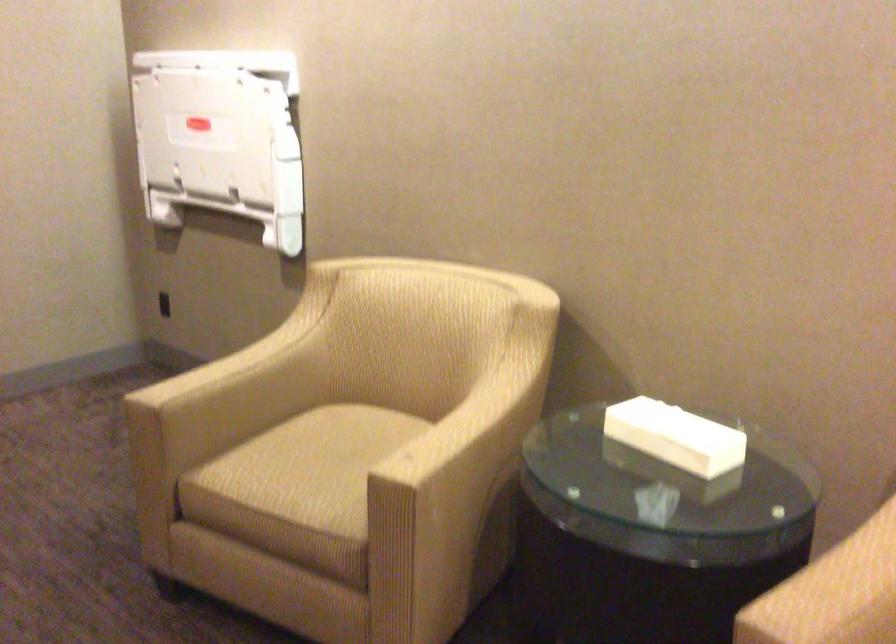
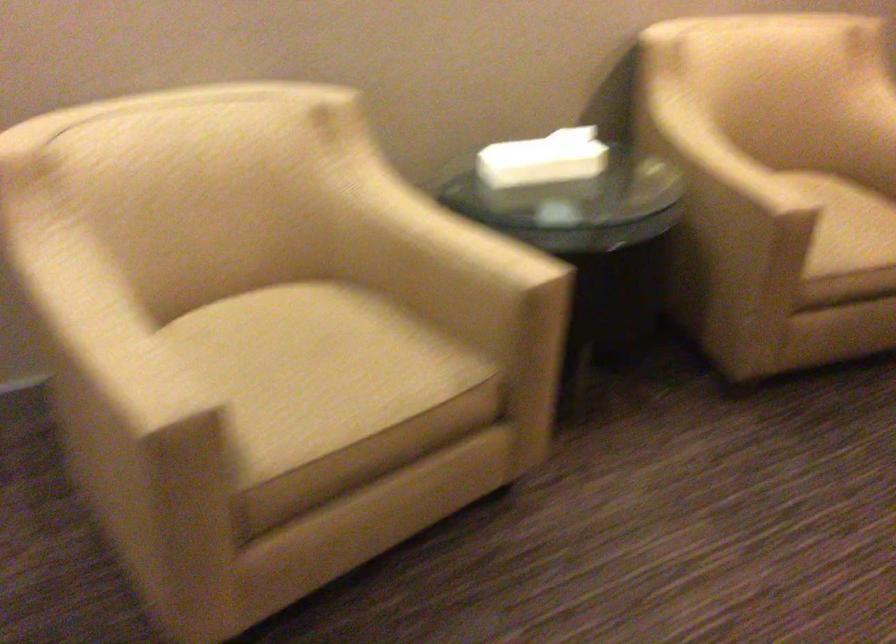
Locate, in the second image, the point that corresponds to pixel 309 464 in the first image.

(316, 370)